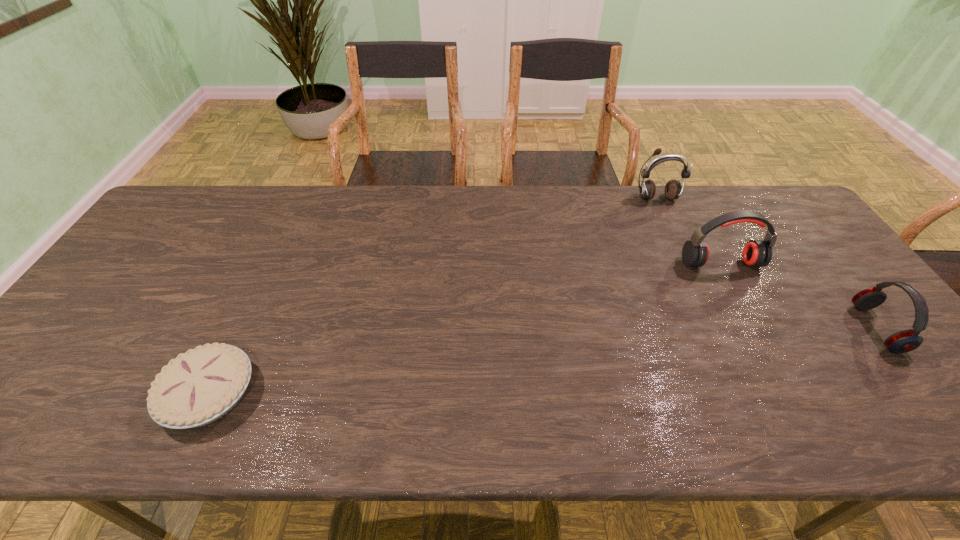
This screenshot has width=960, height=540. What are the coordinates of `free point between the shortest earphone and the shortest object` in the screenshot? It's located at (542, 361).

At what (x,y) coordinates should I click in order to perform the action: click on free area in between the third tallest object and the second nearest earphone. Please return your answer as a coordinate pair (x, y). Image resolution: width=960 pixels, height=540 pixels. Looking at the image, I should click on (799, 296).

I want to click on vacant area that lies between the rightmost earphone and the leftmost object, so click(x=542, y=361).

Find the location of a particular element. The height and width of the screenshot is (540, 960). free space between the leftmost object and the shortest earphone is located at coordinates (542, 361).

Locate an element on the screen. This screenshot has height=540, width=960. vacant area that lies between the pie and the rightmost object is located at coordinates (542, 361).

What are the coordinates of `vacant space that is in between the third nearest object and the nearest earphone` in the screenshot? It's located at (799, 296).

Identify the location of vacant area between the farthest earphone and the second nearest earphone. (688, 231).

At what (x,y) coordinates should I click in order to perform the action: click on free space between the second nearest earphone and the pie. Please return your answer as a coordinate pair (x, y). The height and width of the screenshot is (540, 960). Looking at the image, I should click on (465, 329).

Select which object is the third closest to the rightmost earphone. Please provide its 2D coordinates. Your answer should be formatted as a tuple, i.e. [(x, y)], where the tuple contains the x and y coordinates of a point satisfying the conditions above.

[(200, 386)]

Choose which object is the nearest neighbor to the nearest earphone. Please provide its 2D coordinates. Your answer should be formatted as a tuple, i.e. [(x, y)], where the tuple contains the x and y coordinates of a point satisfying the conditions above.

[(757, 253)]